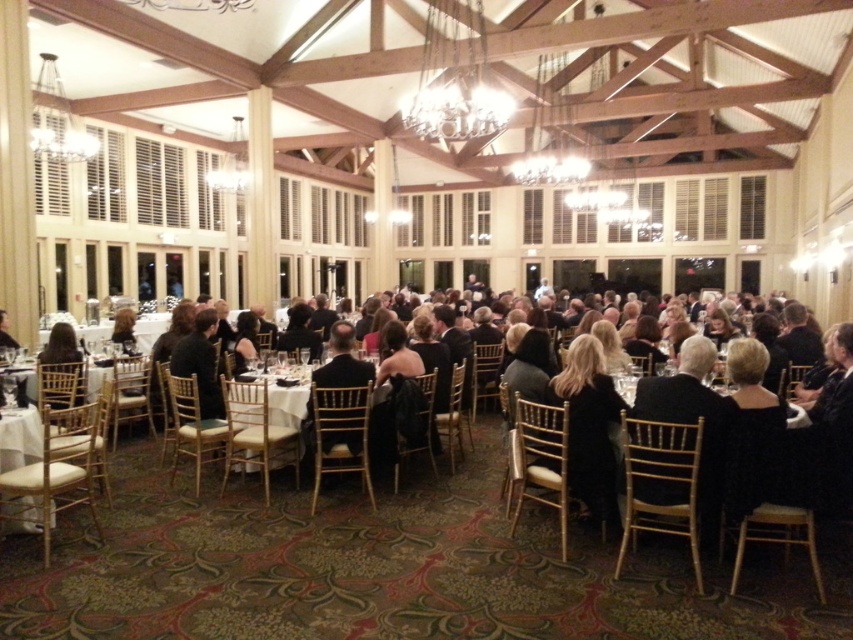
Does black satin suit at center appear under dark brown hair at center?

Yes.

Which is below, black satin suit at center or dark brown hair at center?

Positioned lower is black satin suit at center.

Between point (311, 440) and point (62, 324), which one is positioned behind?

The point (62, 324) is more distant.

Locate an element on the screen. black satin suit at center is located at coordinates (341, 362).

Is point (308, 444) farther from viewer compared to point (357, 362)?

Yes, point (308, 444) is behind point (357, 362).

Is point (312, 424) positioned before point (303, 401)?

Yes, it is.

You are a GUI agent. You are given a task and a screenshot of the screen. Output one action in this format:
    pyautogui.click(x=<x>, y=<y>)
    Task: Click on the black satin suit at center
    The height and width of the screenshot is (640, 853).
    Given the screenshot: What is the action you would take?
    pyautogui.click(x=341, y=362)

Measure the distance from dark brown hair at center to white cloth at center.

They are 1.58 meters apart.

Does point (62, 330) come in front of point (247, 388)?

That is False.

Between point (70, 385) and point (250, 374), which one is positioned behind?

The point (70, 385) is behind.

Image resolution: width=853 pixels, height=640 pixels. I want to click on dark brown hair at center, so click(x=61, y=369).